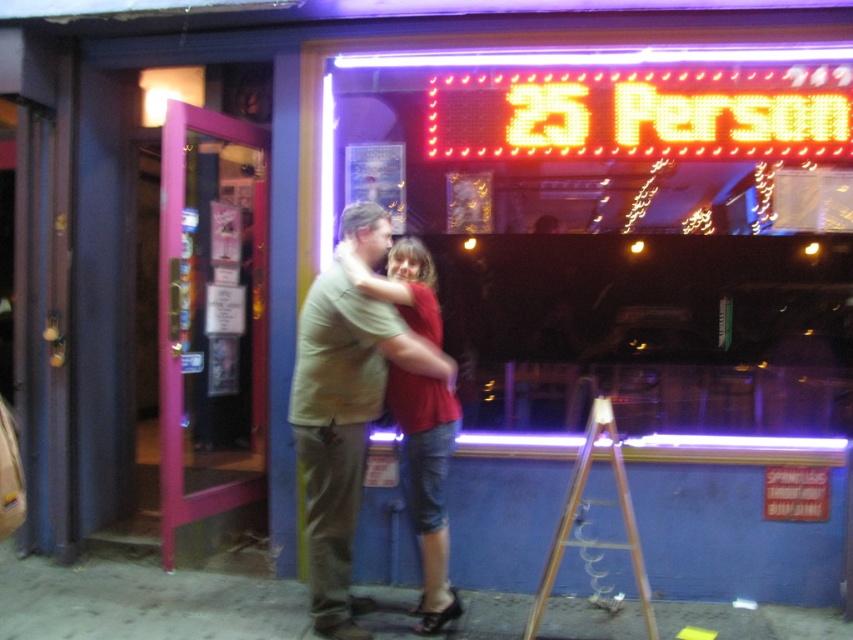
You are standing at the entrance of the establishment and want to move towards the point at coordinates point (347, 486). There is another point at point (689, 99) behind you. Can you walk straight ahead without obstacles?

Yes, since point (689, 99) is behind point (347, 486), there are no obstacles blocking your path straight ahead towards point (347, 486).

You are a photographer trying to capture both the orange led sign at upper center and the matte red shirt at center in a single frame. Given their sizes, which object should you focus on first to ensure both are clearly visible in the photo?

Since the orange led sign at upper center is smaller than the matte red shirt at center, you should focus on the orange led sign at upper center first to ensure its details are sharp while the larger matte red shirt at center will remain in focus more easily.

Based on the scene description, where is the beige cotton shirt at center positioned in terms of coordinates?

The beige cotton shirt at center is located at point [343,426].